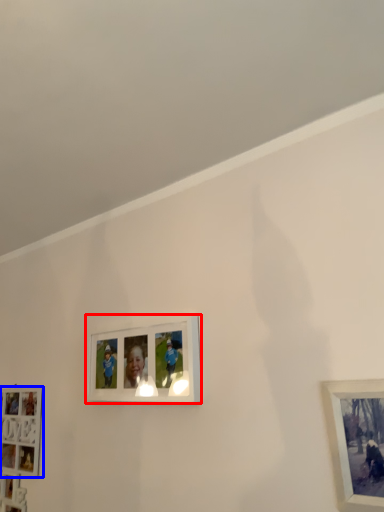
Question: Which object appears farthest to the camera in this image, picture frame (highlighted by a red box) or picture frame (highlighted by a blue box)?

Choices:
 (A) picture frame
 (B) picture frame

Answer: (B)